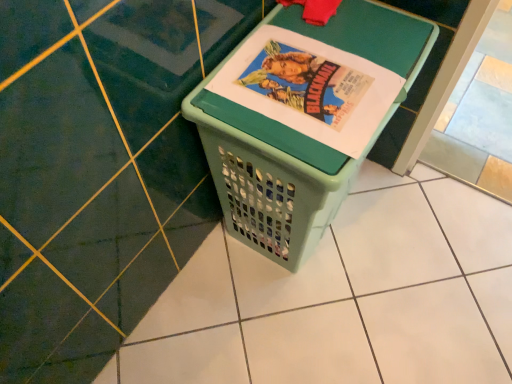
The image size is (512, 384). Describe the element at coordinates (298, 137) in the screenshot. I see `green plastic laundry basket at center` at that location.

At what (x,y) coordinates should I click in order to perform the action: click on green plastic laundry basket at center. Please return your answer as a coordinate pair (x, y). The width and height of the screenshot is (512, 384). Looking at the image, I should click on (298, 137).

From the picture: What is the approximate height of green plastic laundry basket at center?

22.02 inches.

Where is `green plastic laundry basket at center`? Image resolution: width=512 pixels, height=384 pixels. green plastic laundry basket at center is located at coordinates (298, 137).